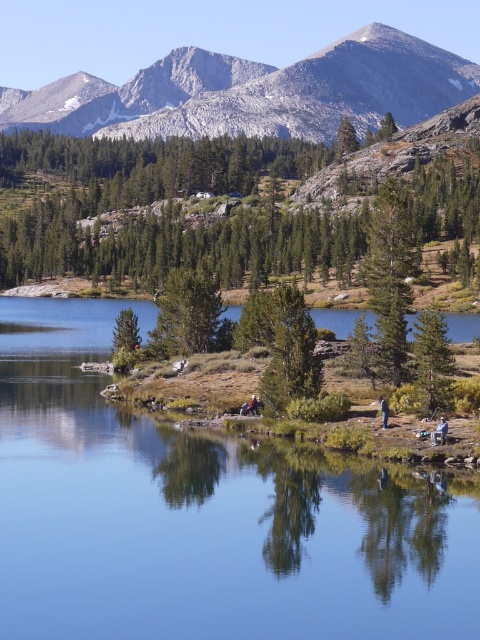
You are standing at the edge of the lake and want to walk to the green matte tree at center. Which direction should you head towards relative to the smooth reflective water at center?

The smooth reflective water at center is positioned on the right side of green matte tree at center. Therefore, to reach the green matte tree at center, you should head towards the left side of the smooth reflective water at center.

You are standing at the lakeside and want to walk towards the green matte tree at upper center and the green matte tree at center. Which tree will you reach first?

You will reach the green matte tree at upper center first because it is closer to you than the green matte tree at center.

You are standing at the lakeshore and want to take a photo of both the green matte tree at upper center and the green matte tree at center. Which tree should you position closer to the front of your camera frame to ensure both are fully visible?

To ensure both the green matte tree at upper center and the green matte tree at center are fully visible, position the green matte tree at center closer to the front of your camera frame since it might be narrower than the green matte tree at upper center.